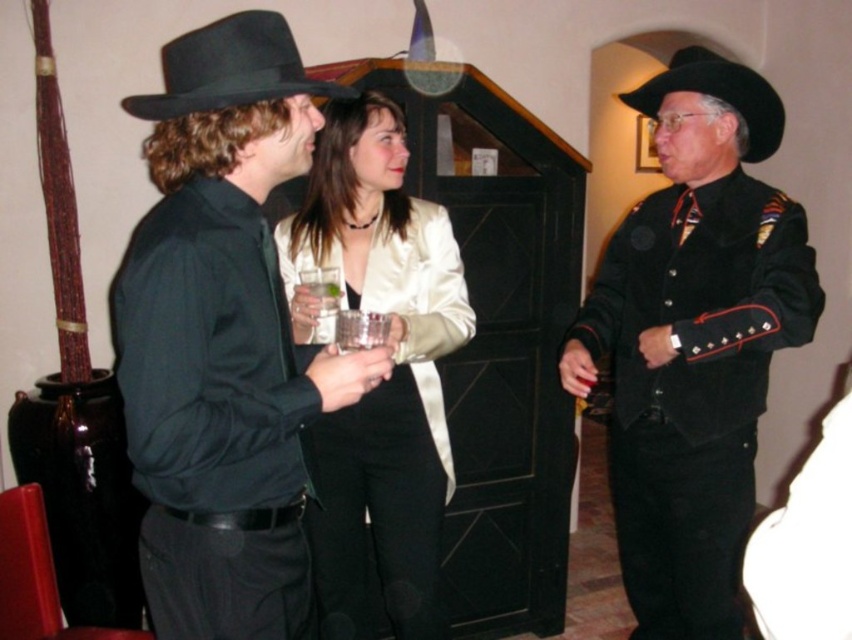
How far apart are satin white jacket at center and black felt fedora at left?

A distance of 31.24 inches exists between satin white jacket at center and black felt fedora at left.

Can you confirm if satin white jacket at center is positioned to the left of black felt fedora at left?

No, satin white jacket at center is not to the left of black felt fedora at left.

Between point (285, 234) and point (291, 80), which one is positioned behind?

The point (285, 234) is more distant.

This screenshot has width=852, height=640. Find the location of `satin white jacket at center`. satin white jacket at center is located at coordinates (384, 380).

Based on the photo, who is taller, black felt fedora at right or clear glass at center?

With more height is black felt fedora at right.

Does black felt fedora at right have a greater height compared to clear glass at center?

Correct, black felt fedora at right is much taller as clear glass at center.

Does point (701, 90) lie in front of point (327, 285)?

No, it is behind (327, 285).

Locate an element on the screen. The width and height of the screenshot is (852, 640). black felt fedora at right is located at coordinates (718, 96).

Which is above, black felt fedora at left or clear glass at center?

Positioned higher is black felt fedora at left.

Can you confirm if black felt fedora at left is shorter than clear glass at center?

No, black felt fedora at left is not shorter than clear glass at center.

Identify the location of black felt fedora at left. This screenshot has width=852, height=640. (229, 68).